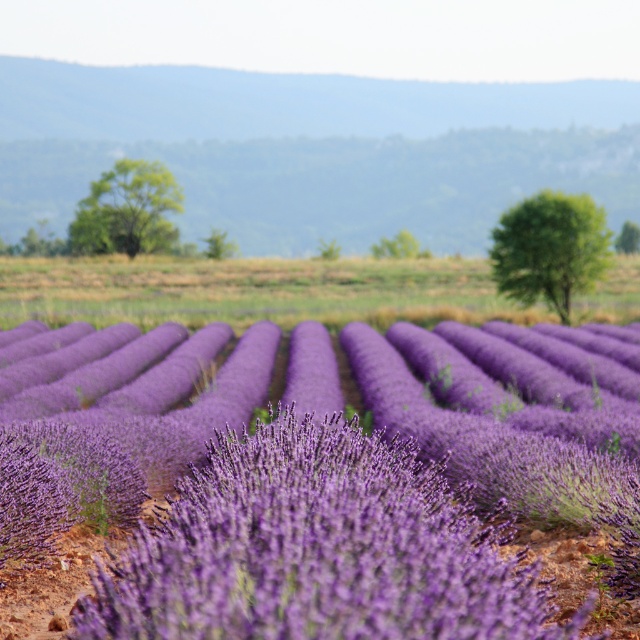
Can you confirm if purple soft-textured lavender at center is positioned above purple soft lavender at center?

No, purple soft-textured lavender at center is not above purple soft lavender at center.

How far apart are purple soft-textured lavender at center and purple soft lavender at center?

The distance of purple soft-textured lavender at center from purple soft lavender at center is 27.35 meters.

Where is `purple soft-textured lavender at center`? This screenshot has width=640, height=640. purple soft-textured lavender at center is located at coordinates [x=310, y=506].